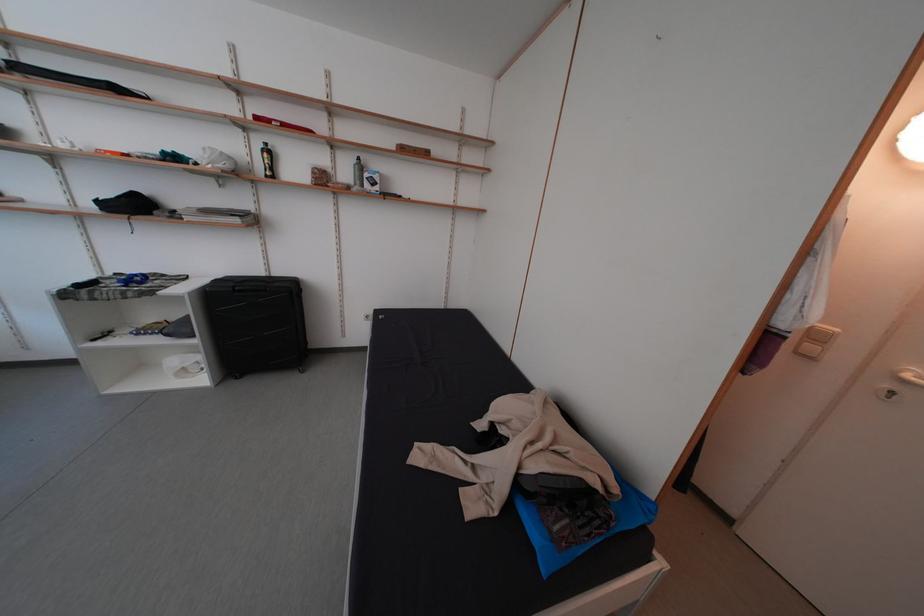
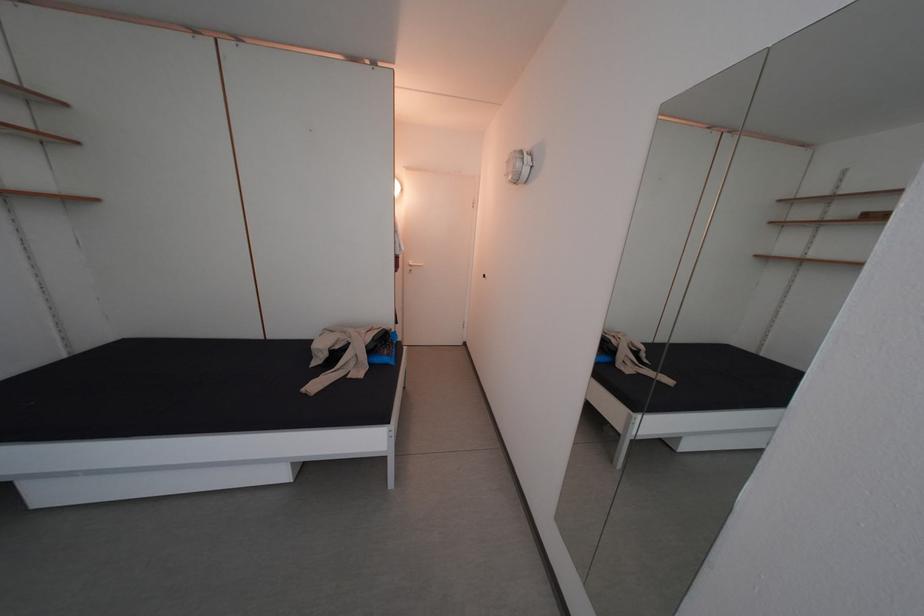
Find the pixel in the second image that matches point (776, 342) in the first image.

(407, 264)